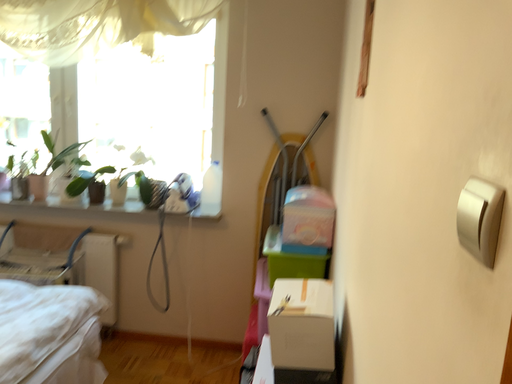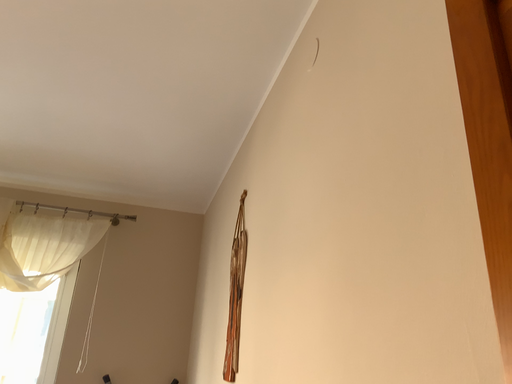
Question: Which way did the camera rotate in the video?

Choices:
 (A) rotated left
 (B) rotated right

Answer: (B)